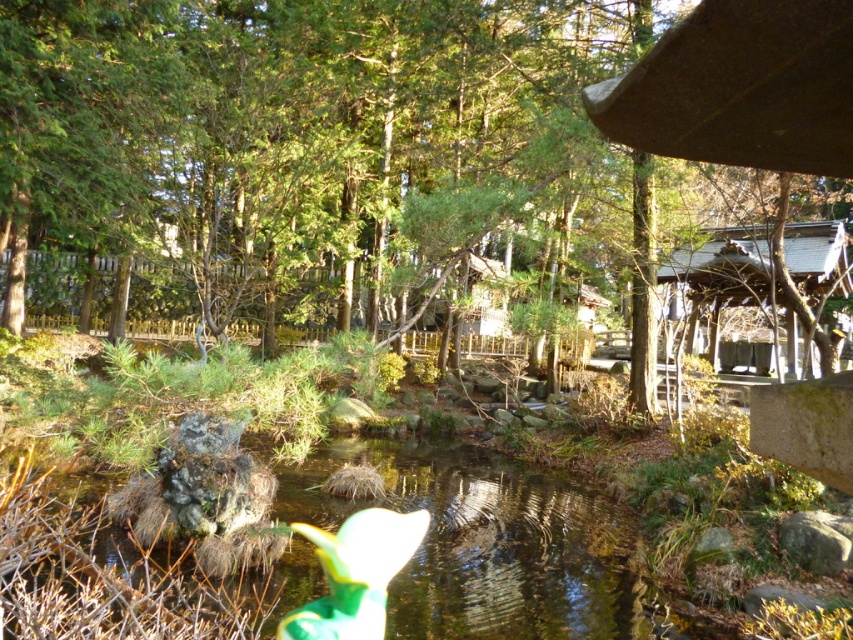
Who is more forward, (428, 449) or (376, 604)?

Point (376, 604) is more forward.

Which of these two, clear water at center or green fabric toy at lower center, stands shorter?

With less height is clear water at center.

Is point (393, 595) farther from viewer compared to point (303, 522)?

No, it is not.

I want to click on clear water at center, so click(498, 545).

Can you confirm if green leafy tree at center is shorter than wooden cabin at right?

In fact, green leafy tree at center may be taller than wooden cabin at right.

Is green leafy tree at center taller than wooden cabin at right?

Yes, green leafy tree at center is taller than wooden cabin at right.

Between point (440, 16) and point (703, 275), which one is positioned in front?

Point (440, 16) is in front.

At what (x,y) coordinates should I click in order to perform the action: click on green leafy tree at center. Please return your answer as a coordinate pair (x, y). The height and width of the screenshot is (640, 853). Looking at the image, I should click on (384, 154).

Can you confirm if clear water at center is bigger than wooden cabin at right?

No.

Between clear water at center and wooden cabin at right, which one has more height?

wooden cabin at right is taller.

The width and height of the screenshot is (853, 640). Find the location of `clear water at center`. clear water at center is located at coordinates (498, 545).